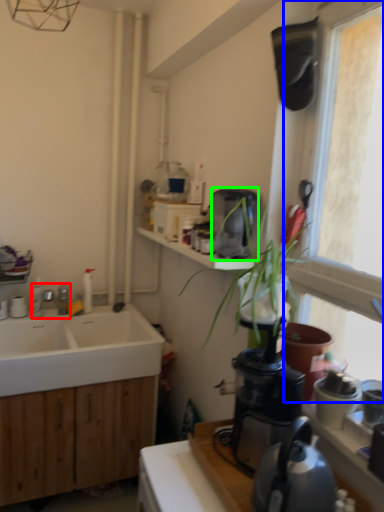
Question: Estimate the real-world distances between objects in this image. Which object is farther from tap (highlighted by a red box), window (highlighted by a blue box) or coffee maker (highlighted by a green box)?

Choices:
 (A) window
 (B) coffee maker

Answer: (A)